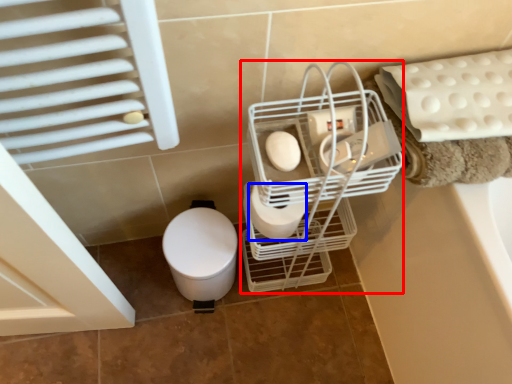
Question: Which object is closer to the camera taking this photo, trolley (highlighted by a red box) or toilet paper (highlighted by a blue box)?

Choices:
 (A) trolley
 (B) toilet paper

Answer: (A)